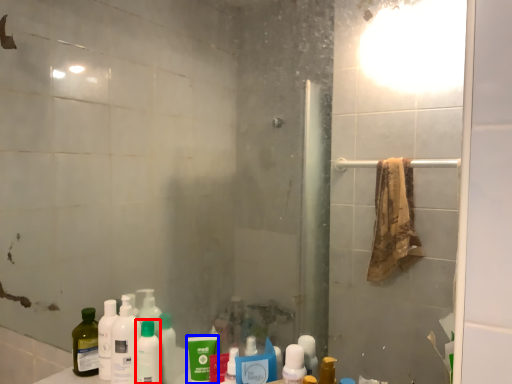
Question: Which point is further to the camera, toiletry (highlighted by a red box) or mouthwash (highlighted by a blue box)?

Choices:
 (A) toiletry
 (B) mouthwash

Answer: (A)